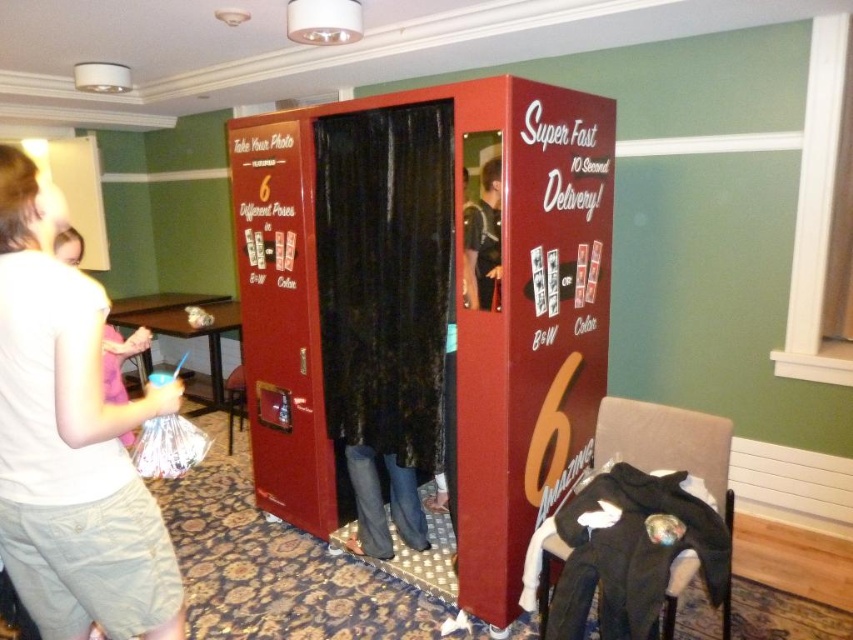
Can you confirm if metallic red photo booth at center is taller than dark blue shirt at center?

Yes, metallic red photo booth at center is taller than dark blue shirt at center.

In the scene shown: Can you confirm if metallic red photo booth at center is positioned above dark blue shirt at center?

Answer: Actually, metallic red photo booth at center is below dark blue shirt at center.

Who is more distant from viewer, (424,358) or (497,248)?

Point (424,358)

You are a GUI agent. You are given a task and a screenshot of the screen. Output one action in this format:
    pyautogui.click(x=<x>, y=<y>)
    Task: Click on the metallic red photo booth at center
    
    Given the screenshot: What is the action you would take?
    pyautogui.click(x=425, y=310)

Who is lower down, white cotton shirt at left or dark blue shirt at center?

white cotton shirt at left is below.

In the scene shown: Does white cotton shirt at left have a greater height compared to dark blue shirt at center?

Indeed, white cotton shirt at left has a greater height compared to dark blue shirt at center.

Who is more distant from viewer, (36, 291) or (486, 250)?

The point (486, 250) is more distant.

Find the location of a particular element. The image size is (853, 640). white cotton shirt at left is located at coordinates tap(71, 442).

Does point (477, 356) come in front of point (13, 525)?

No, (477, 356) is further to viewer.

Measure the distance between point (x=428, y=237) and camera.

2.41 meters

Image resolution: width=853 pixels, height=640 pixels. In order to click on metallic red photo booth at center in this screenshot , I will do `click(425, 310)`.